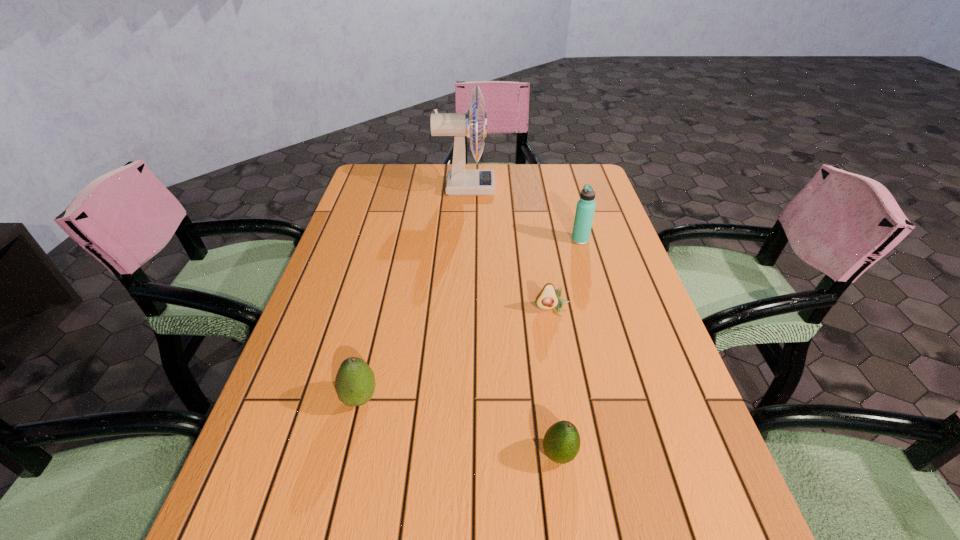
At what (x,y) coordinates should I click in order to perform the action: click on the farthest object. Please return your answer as a coordinate pair (x, y). Looking at the image, I should click on (460, 181).

Where is `fan`? fan is located at coordinates (460, 181).

In order to click on thermos bottle in this screenshot , I will do `click(585, 209)`.

The width and height of the screenshot is (960, 540). In order to click on the rightmost object in this screenshot , I will do `click(585, 209)`.

Image resolution: width=960 pixels, height=540 pixels. What are the coordinates of `the second nearest avocado` in the screenshot? It's located at (355, 384).

I want to click on the tallest avocado, so (x=355, y=384).

This screenshot has width=960, height=540. I want to click on the nearest avocado, so click(561, 443).

I want to click on the third farthest object, so click(548, 298).

At what (x,y) coordinates should I click in order to perform the action: click on vacant space located on the front-facing side of the farthest object. Please return your answer as a coordinate pair (x, y). The width and height of the screenshot is (960, 540). Looking at the image, I should click on (575, 187).

Find the location of a particular element. This screenshot has width=960, height=540. free space located 0.120m on the front of the fourth shortest object is located at coordinates 589,273.